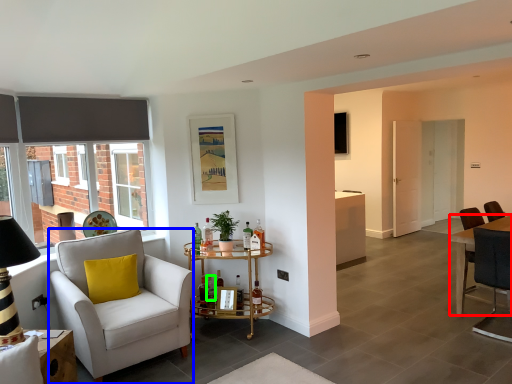
Question: Considering the real-world distances, which object is closest to desk (highlighted by a red box)? chair (highlighted by a blue box) or bottle (highlighted by a green box).

Choices:
 (A) chair
 (B) bottle

Answer: (B)